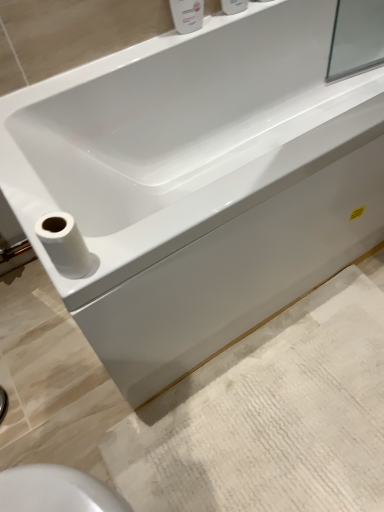
I want to click on vacant space that is to the left of white glossy soap dispenser at upper center, which is the 2th toiletry from right to left, so click(x=144, y=50).